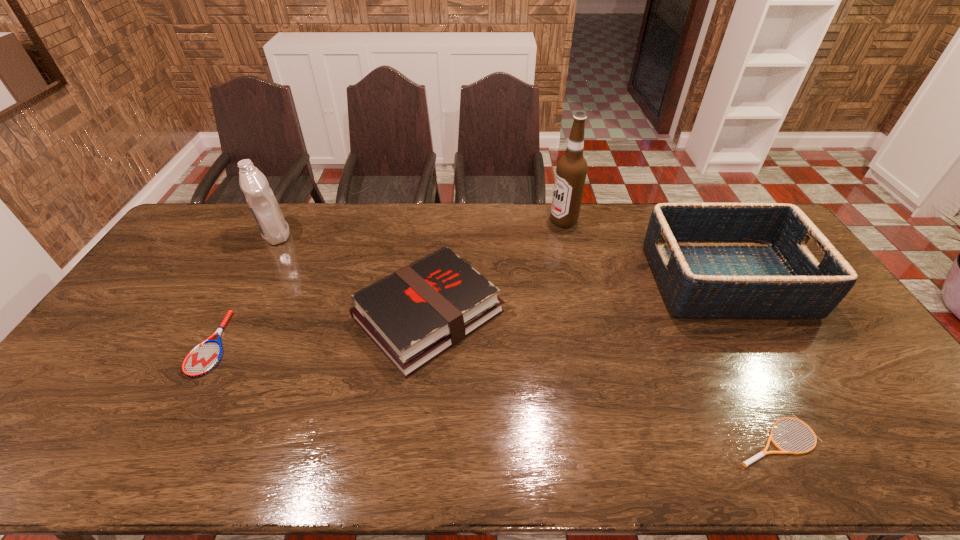
Where is `free space located 0.060m on the label of the alcohol`? Image resolution: width=960 pixels, height=540 pixels. free space located 0.060m on the label of the alcohol is located at coordinates (534, 221).

The height and width of the screenshot is (540, 960). What are the coordinates of `vacant space situated 0.260m on the label of the alcohol` in the screenshot? It's located at pos(479,221).

I want to click on vacant space situated on the label of the alcohol, so click(x=509, y=221).

Locate an element on the screen. The width and height of the screenshot is (960, 540). free region located 0.050m on the right of the detergent is located at coordinates (306, 234).

I want to click on vacant space located on the front of the third tallest object, so click(x=780, y=377).

This screenshot has width=960, height=540. Identify the location of free space located 0.150m on the left of the hardback book. (301, 314).

Find the location of a particular element. free location located 0.050m on the left of the taller tennis racket is located at coordinates (179, 343).

The image size is (960, 540). Identify the location of free spot located on the left of the shortest object. (692, 440).

Where is `alcohol that is at the far edge`? This screenshot has width=960, height=540. alcohol that is at the far edge is located at coordinates (571, 170).

Locate an element on the screen. This screenshot has height=540, width=960. detergent present at the far edge is located at coordinates (264, 207).